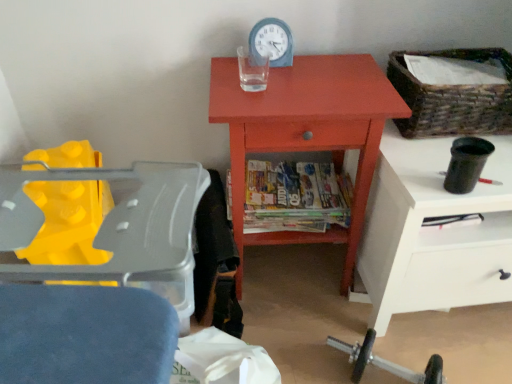
Locate an element on the screen. vacant area situated to the left side of blue plastic clock at upper center is located at coordinates (232, 67).